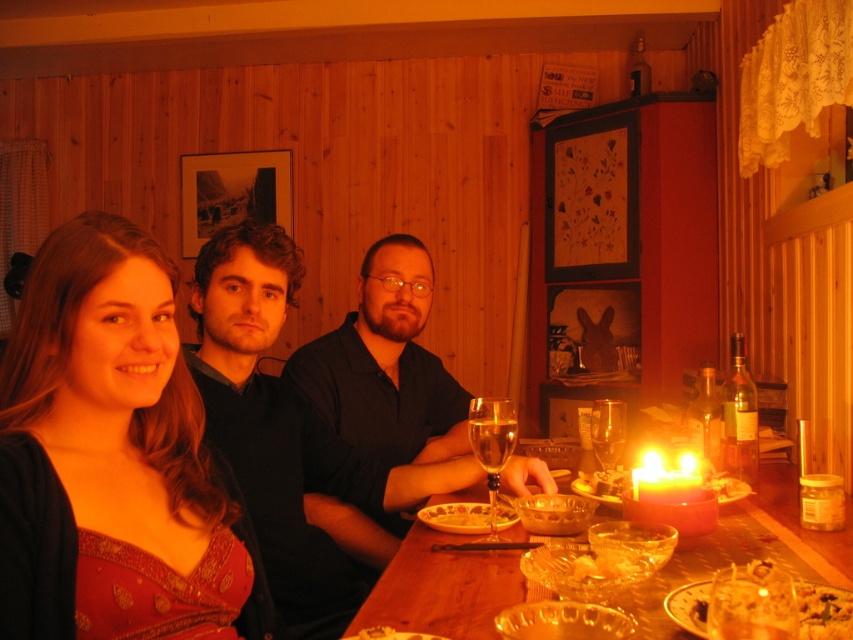
Question: Among these points, which one is nearest to the camera?

Choices:
 (A) (665, 625)
 (B) (418, 364)
 (C) (474, 401)

Answer: (A)

Question: Can you confirm if clear glass wine glass at center is thinner than translucent glass bowl at table?

Choices:
 (A) yes
 (B) no

Answer: (A)

Question: Does matte red dress at left have a larger size compared to clear glass wine glass at table center?

Choices:
 (A) no
 (B) yes

Answer: (B)

Question: Does dark blue shirt at center appear under black matte shirt at center?

Choices:
 (A) yes
 (B) no

Answer: (A)

Question: Estimate the real-world distances between objects in this image. Which object is closer to the matte black shirt at center?

Choices:
 (A) clear glass wine glass at table center
 (B) matte glass platter at lower right
 (C) black matte shirt at center
 (D) dark blue shirt at center

Answer: (D)

Question: Which is nearer to the translucent glass table at center?

Choices:
 (A) matte glass platter at lower right
 (B) dark blue shirt at center
 (C) matte black shirt at center

Answer: (A)